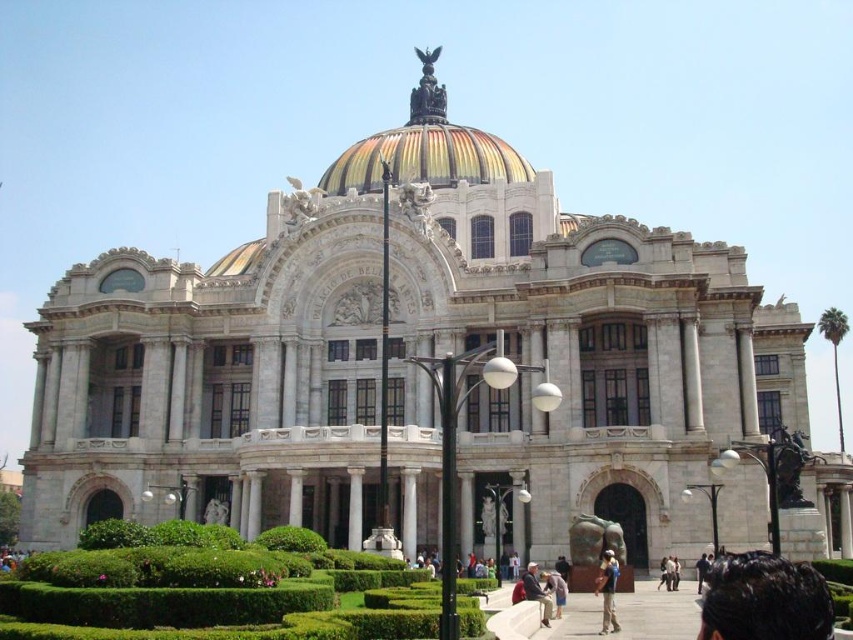
Can you confirm if polished bronze eagle at center is shorter than light brown leather jacket at lower right?

In fact, polished bronze eagle at center may be taller than light brown leather jacket at lower right.

Which is above, polished bronze eagle at center or light brown leather jacket at lower right?

polished bronze eagle at center is higher up.

Image resolution: width=853 pixels, height=640 pixels. I want to click on polished bronze eagle at center, so click(x=427, y=92).

Is polished bronze eagle at center in front of dark blue jeans at center?

No, polished bronze eagle at center is behind dark blue jeans at center.

Does polished bronze eagle at center appear over dark blue jeans at center?

Indeed, polished bronze eagle at center is positioned over dark blue jeans at center.

Does point (445, 100) lie behind point (700, 577)?

That is True.

This screenshot has width=853, height=640. I want to click on polished bronze eagle at center, so click(x=427, y=92).

Based on the photo, how much distance is there between green leafy hedge at lower center and white marble statue at upper center?

26.97 meters

Does green leafy hedge at lower center have a lesser width compared to white marble statue at upper center?

Correct, green leafy hedge at lower center's width is less than white marble statue at upper center's.

Who is more distant from viewer, (274,548) or (297,186)?

Point (297,186)

Image resolution: width=853 pixels, height=640 pixels. Find the location of `green leafy hedge at lower center`. green leafy hedge at lower center is located at coordinates (289, 540).